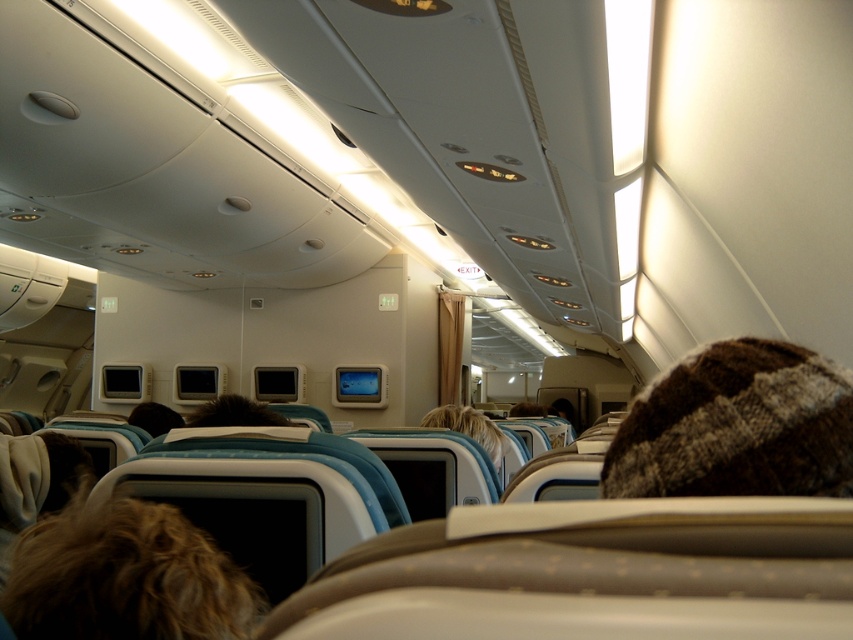
Is brown knitted hat at upper right taller than brown fuzzy hair at lower left?

In fact, brown knitted hat at upper right may be shorter than brown fuzzy hair at lower left.

What do you see at coordinates (737, 426) in the screenshot?
I see `brown knitted hat at upper right` at bounding box center [737, 426].

Which is in front, point (822, 454) or point (212, 576)?

Point (822, 454)

This screenshot has height=640, width=853. I want to click on brown knitted hat at upper right, so click(x=737, y=426).

Consider the image. Does brown knitted hat at upper right have a smaller size compared to blonde hair at center?

Correct, brown knitted hat at upper right occupies less space than blonde hair at center.

Between brown knitted hat at upper right and blonde hair at center, which one appears on the left side from the viewer's perspective?

Positioned to the left is blonde hair at center.

The height and width of the screenshot is (640, 853). What do you see at coordinates (737, 426) in the screenshot?
I see `brown knitted hat at upper right` at bounding box center [737, 426].

Find the location of a particular element. brown knitted hat at upper right is located at coordinates (737, 426).

Is brown fuzzy hair at lower left taller than blonde hair at center?

No.

Does point (202, 560) lie behind point (502, 440)?

No, it is not.

Find the location of a particular element. Image resolution: width=853 pixels, height=640 pixels. brown fuzzy hair at lower left is located at coordinates (126, 577).